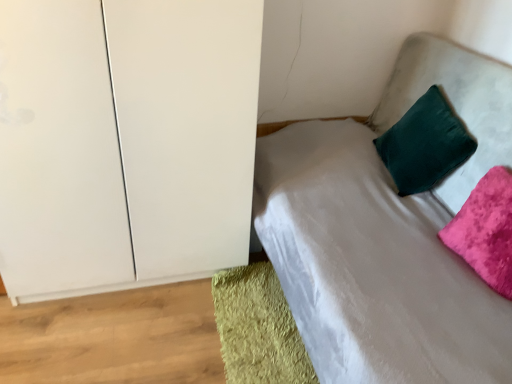
Question: Considering the positions of point (225, 301) and point (453, 165), is point (225, 301) closer or farther from the camera than point (453, 165)?

Choices:
 (A) closer
 (B) farther

Answer: (B)

Question: From the image's perspective, is green shaggy rug at lower left located above or below velvet green pillow at upper right, the second pillow positioned from the front?

Choices:
 (A) below
 (B) above

Answer: (A)

Question: Based on their relative distances, which object is nearer to the velvet green pillow at upper right, the second pillow positioned from the front?

Choices:
 (A) white matte cabinet at left
 (B) velvet green pillow at upper right
 (C) velvet pink pillow at upper right, the 2th pillow viewed from the back
 (D) green shaggy rug at lower left

Answer: (B)

Question: Based on their relative distances, which object is nearer to the green shaggy rug at lower left?

Choices:
 (A) velvet pink pillow at upper right, the 2th pillow viewed from the back
 (B) velvet green pillow at upper right, the second pillow positioned from the front
 (C) white matte cabinet at left
 (D) velvet green pillow at upper right

Answer: (D)